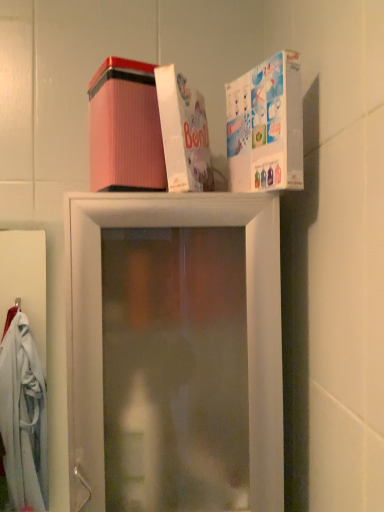
Question: Considering the relative positions of pink corrugated box at upper center, the first box positioned from the left, and white cardboard box at upper center, placed as the 2th box when sorted from right to left, in the image provided, is pink corrugated box at upper center, the first box positioned from the left, to the left or to the right of white cardboard box at upper center, placed as the 2th box when sorted from right to left,?

Choices:
 (A) right
 (B) left

Answer: (B)

Question: Is pink corrugated box at upper center, the first box positioned from the left, situated inside white cardboard box at upper center, which is the second box in left-to-right order, or outside?

Choices:
 (A) outside
 (B) inside

Answer: (A)

Question: Which is nearer to the white cardboard box at upper center, placed as the 2th box when sorted from right to left?

Choices:
 (A) pink corrugated box at upper center, the first box positioned from the left
 (B) transparent plastic shelf at upper center
 (C) white glossy box at upper right, the 3th box viewed from the left

Answer: (A)

Question: Which object is positioned farthest from the pink corrugated box at upper center, the first box positioned from the left?

Choices:
 (A) white glossy box at upper right, the 3th box viewed from the left
 (B) white cardboard box at upper center, which is the second box in left-to-right order
 (C) transparent plastic shelf at upper center

Answer: (C)